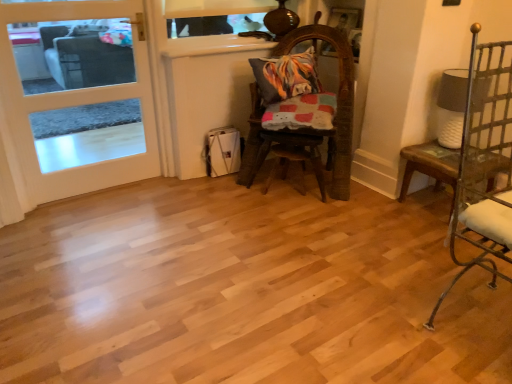
Question: Considering the relative sizes of worn wood chair at center, marked as the 1th chair in a back-to-front arrangement, and metallic silver chair at right, the 2th chair viewed from the left, in the image provided, is worn wood chair at center, marked as the 1th chair in a back-to-front arrangement, wider than metallic silver chair at right, the 2th chair viewed from the left,?

Choices:
 (A) yes
 (B) no

Answer: (A)

Question: From a real-world perspective, is worn wood chair at center, arranged as the first chair when viewed from the left, below metallic silver chair at right, the 2th chair viewed from the left?

Choices:
 (A) yes
 (B) no

Answer: (A)

Question: Is worn wood chair at center, arranged as the first chair when viewed from the left, in contact with metallic silver chair at right, positioned as the first chair in right-to-left order?

Choices:
 (A) yes
 (B) no

Answer: (B)

Question: From the image's perspective, is worn wood chair at center, which is the second chair from right to left, above metallic silver chair at right, the 1th chair from the front?

Choices:
 (A) no
 (B) yes

Answer: (B)

Question: Is worn wood chair at center, which is the second chair from right to left, at the right side of metallic silver chair at right, positioned as the 2th chair in back-to-front order?

Choices:
 (A) yes
 (B) no

Answer: (B)

Question: Is worn wood chair at center, which is the second chair from right to left, to the left of metallic silver chair at right, positioned as the first chair in right-to-left order, from the viewer's perspective?

Choices:
 (A) no
 (B) yes

Answer: (B)

Question: Is the surface of white ceramic table at right in direct contact with metallic silver chair at right, positioned as the first chair in right-to-left order?

Choices:
 (A) yes
 (B) no

Answer: (B)

Question: From a real-world perspective, does white ceramic table at right sit lower than metallic silver chair at right, positioned as the first chair in right-to-left order?

Choices:
 (A) yes
 (B) no

Answer: (A)

Question: Is white ceramic table at right in front of metallic silver chair at right, the 2th chair viewed from the left?

Choices:
 (A) yes
 (B) no

Answer: (B)

Question: Is metallic silver chair at right, positioned as the 2th chair in back-to-front order, at the back of white ceramic table at right?

Choices:
 (A) yes
 (B) no

Answer: (B)

Question: From a real-world perspective, is white ceramic table at right located higher than metallic silver chair at right, positioned as the first chair in right-to-left order?

Choices:
 (A) yes
 (B) no

Answer: (B)

Question: Considering the relative sizes of white ceramic table at right and metallic silver chair at right, the 2th chair viewed from the left, in the image provided, is white ceramic table at right bigger than metallic silver chair at right, the 2th chair viewed from the left,?

Choices:
 (A) yes
 (B) no

Answer: (B)

Question: From a real-world perspective, is white wood door at left positioned over worn wood chair at center, marked as the 1th chair in a back-to-front arrangement, based on gravity?

Choices:
 (A) no
 (B) yes

Answer: (B)